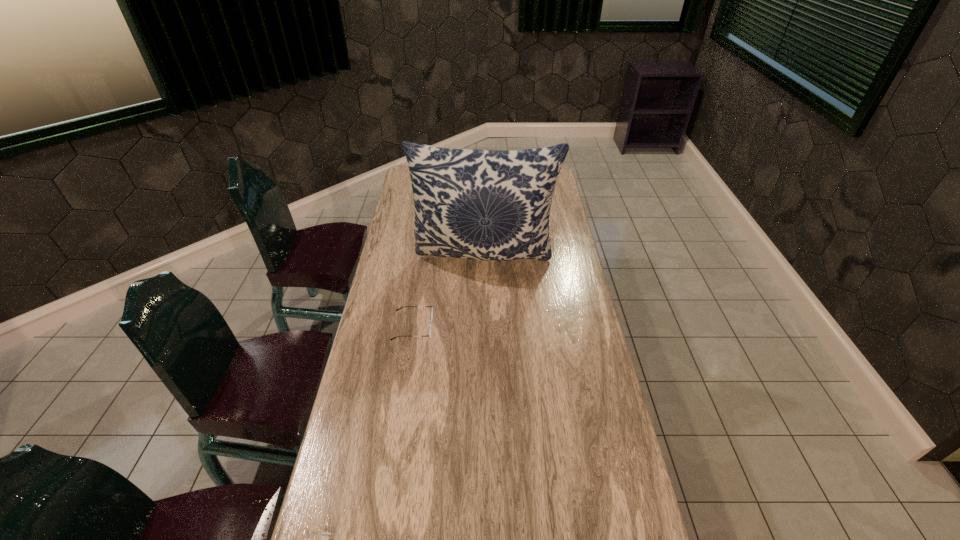
At what (x,y) coordinates should I click in order to perform the action: click on the farthest object. Please return your answer as a coordinate pair (x, y). This screenshot has height=540, width=960. Looking at the image, I should click on (490, 205).

Image resolution: width=960 pixels, height=540 pixels. Identify the location of cushion. (490, 205).

Where is `the second nearest object`? The height and width of the screenshot is (540, 960). the second nearest object is located at coordinates (429, 335).

At what (x,y) coordinates should I click in order to perform the action: click on spectacles. Please return your answer as a coordinate pair (x, y). The image size is (960, 540). Looking at the image, I should click on (429, 335).

Where is `vacant space located 0.240m on the front surface of the tallest object`? The width and height of the screenshot is (960, 540). vacant space located 0.240m on the front surface of the tallest object is located at coordinates (486, 332).

Image resolution: width=960 pixels, height=540 pixels. What are the coordinates of `free space located 0.300m on the lenses of the second tallest object` in the screenshot? It's located at (523, 327).

Identify the location of cushion that is at the left edge. (490, 205).

The image size is (960, 540). What are the coordinates of `spectacles located in the left edge section of the desktop` in the screenshot? It's located at (429, 335).

Find the location of a particular element. This screenshot has width=960, height=540. object that is at the right edge is located at coordinates (490, 205).

Find the location of a particular element. vacant space at the left edge is located at coordinates (388, 291).